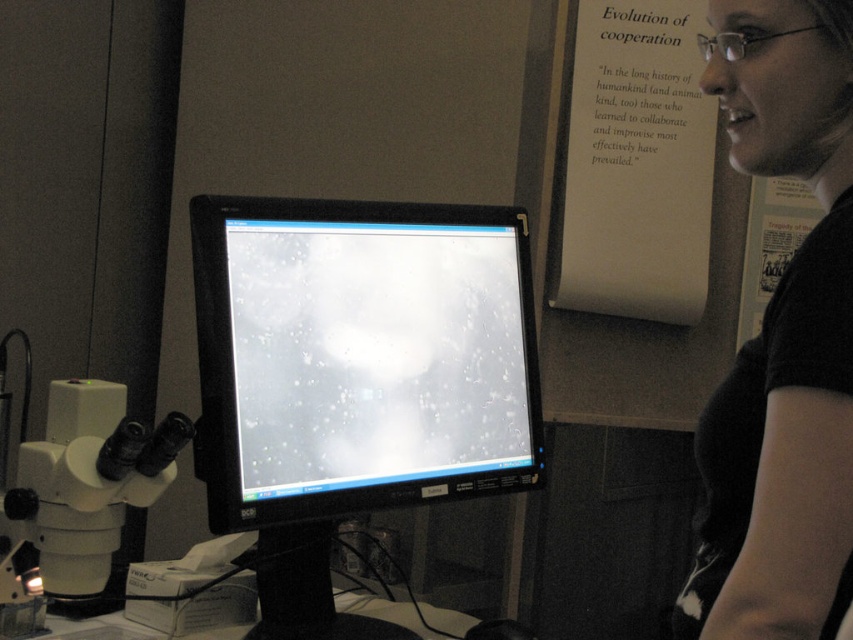
Question: Estimate the real-world distances between objects in this image. Which object is closer to the white plastic microscope at lower left?

Choices:
 (A) black glossy monitor at center
 (B) white paper at upper right
 (C) black matte shirt at upper right

Answer: (A)

Question: Which of the following is the farthest from the observer?

Choices:
 (A) (808, 356)
 (B) (287, 632)

Answer: (B)

Question: Is black matte shirt at upper right further to camera compared to white plastic microscope at lower left?

Choices:
 (A) yes
 (B) no

Answer: (B)

Question: Based on their relative distances, which object is nearer to the black matte shirt at upper right?

Choices:
 (A) white paper at upper right
 (B) white plastic microscope at lower left
 (C) black glossy monitor at center

Answer: (C)

Question: Is black glossy monitor at center in front of black matte shirt at upper right?

Choices:
 (A) no
 (B) yes

Answer: (A)

Question: Does black glossy monitor at center appear on the left side of white paper at upper right?

Choices:
 (A) no
 (B) yes

Answer: (B)